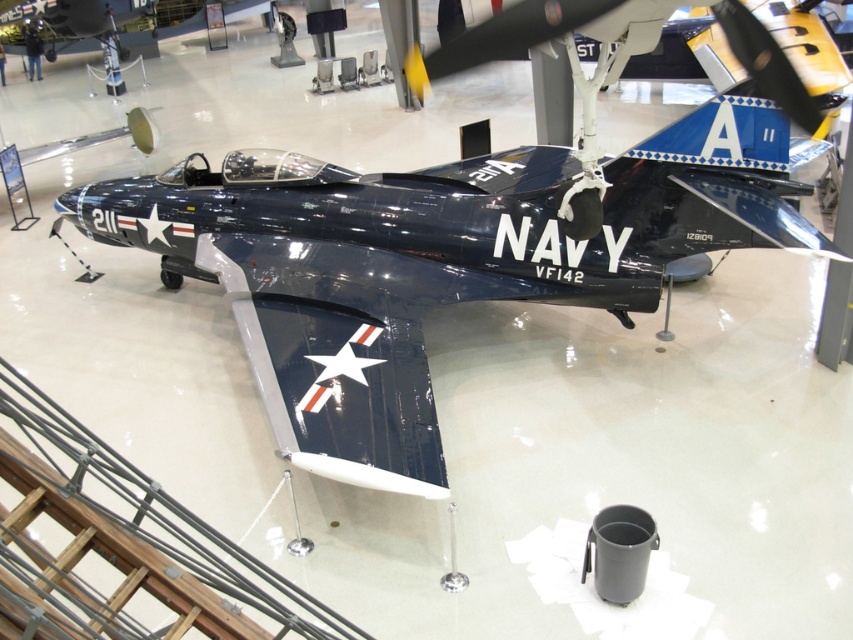
You are standing in a museum and see the glossy navy blue airplane at center. If you want to take a photo of it without any reflections from the floor, how far back should you stand?

The glossy navy blue airplane at center is 3.84 meters away from viewer. To avoid reflections, you should stand at least 3.84 meters away from the airplane to ensure the angle of incidence equals the angle of reflection, minimizing glare from the reflective floor.

You are a museum curator planning to install a new exhibit. You need to place a 1.5 meter wide display case between the glossy navy blue airplane at center and the glossy metallic airplane at center. Is there enough space between them to accommodate the display case?

The distance between the glossy navy blue airplane at center and the glossy metallic airplane at center is 7.07 meters. Since the display case is only 1.5 meters wide, there is sufficient space to place it between them.